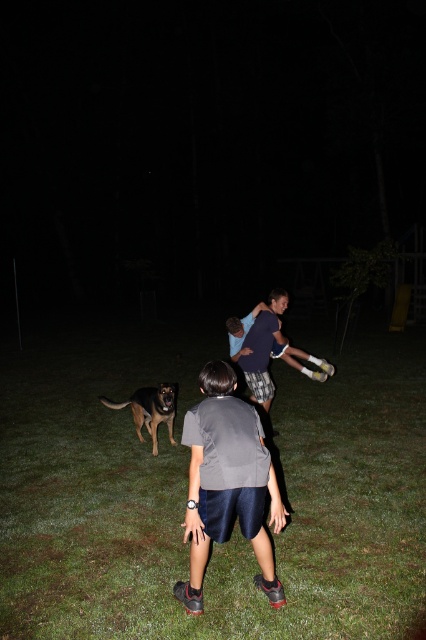
You are a photographer standing at the camera position. You want to capture a photo that includes both the gray fabric shirt at center and the brown fur dog at lower left. What is the minimum distance you need to move backward to ensure both subjects are in frame?

The minimum distance you need to move backward is 1.5 meters to ensure both the gray fabric shirt at center and the brown fur dog at lower left are in frame.